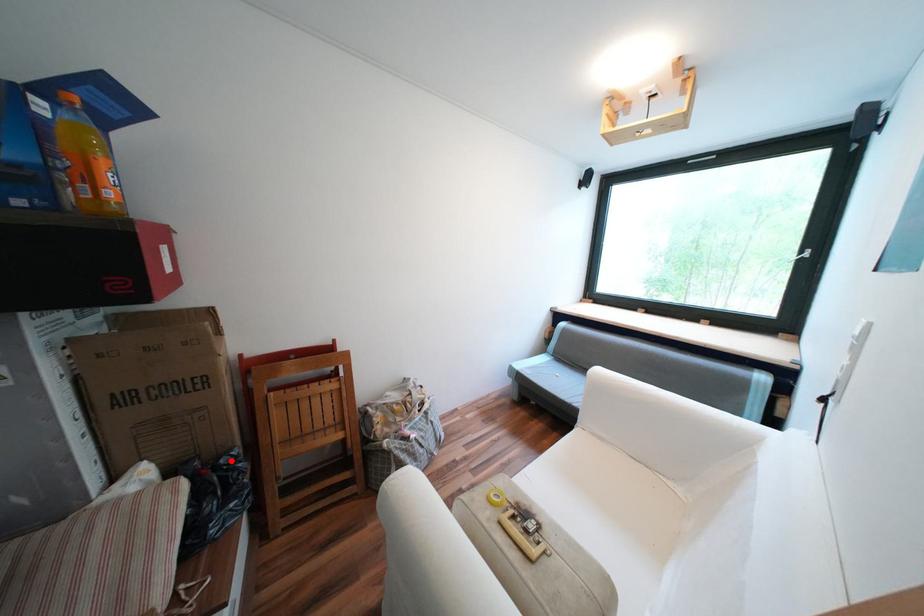
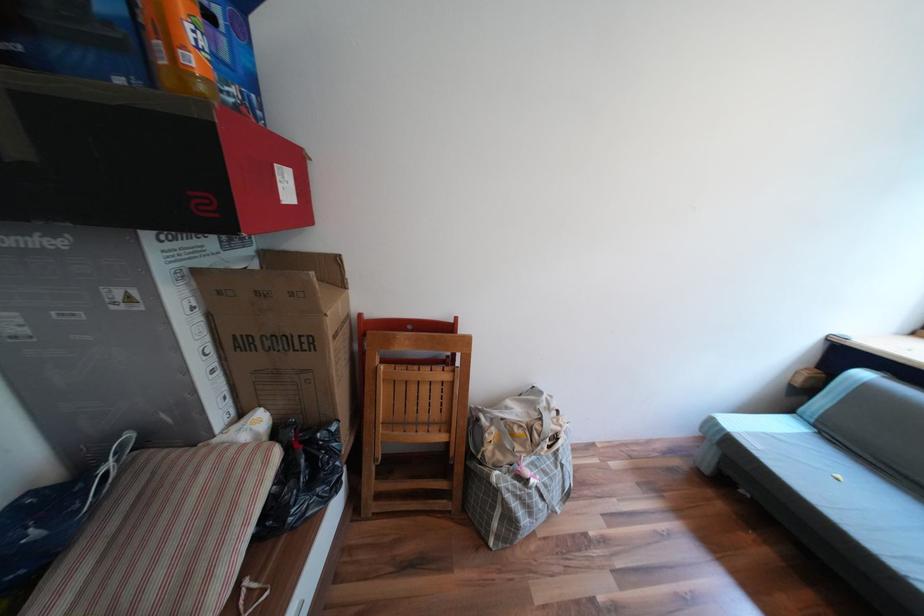
The point at the highlighted location is marked in the first image. Where is the corresponding point in the second image?

(327, 435)